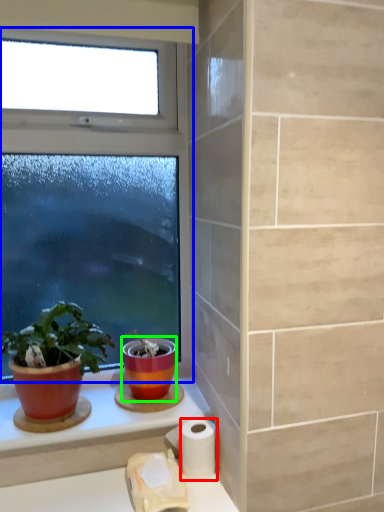
Question: Considering the real-world distances, which object is farthest from toilet paper (highlighted by a red box)? window (highlighted by a blue box) or flowerpot (highlighted by a green box)?

Choices:
 (A) window
 (B) flowerpot

Answer: (A)